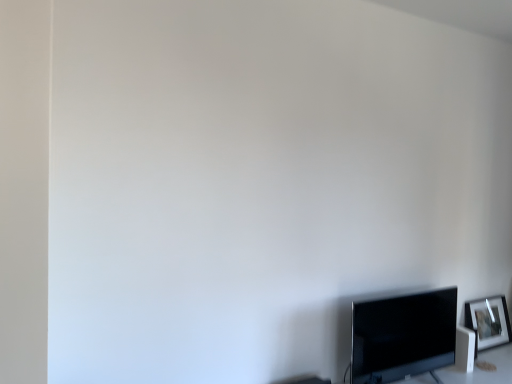
Measure the distance between silver metallic picture frame at lower right and camera.

They are 2.60 meters apart.

The image size is (512, 384). Describe the element at coordinates (488, 322) in the screenshot. I see `silver metallic picture frame at lower right` at that location.

The image size is (512, 384). I want to click on silver metallic picture frame at lower right, so click(488, 322).

This screenshot has height=384, width=512. Identify the location of matte black tv at lower right. (403, 336).

Measure the distance between point (423,334) and camera.

7.23 feet.

Consider the image. What is the approximate height of matte black tv at lower right?

matte black tv at lower right is 47.44 centimeters tall.

Describe the element at coordinates (403, 336) in the screenshot. I see `matte black tv at lower right` at that location.

The width and height of the screenshot is (512, 384). In order to click on silver metallic picture frame at lower right in this screenshot , I will do coord(488,322).

Is matte black tv at lower right at the left side of silver metallic picture frame at lower right?

Yes, matte black tv at lower right is to the left of silver metallic picture frame at lower right.

Is matte black tv at lower right positioned behind silver metallic picture frame at lower right?

No, the depth of matte black tv at lower right is less than that of silver metallic picture frame at lower right.

Is point (362, 378) closer to viewer compared to point (508, 321)?

Yes, point (362, 378) is closer to viewer.

From the image's perspective, does matte black tv at lower right appear higher than silver metallic picture frame at lower right?

Indeed, from the image's perspective, matte black tv at lower right is shown above silver metallic picture frame at lower right.

From a real-world perspective, which object stands above the other?

matte black tv at lower right.

Which of these two, matte black tv at lower right or silver metallic picture frame at lower right, is thinner?

silver metallic picture frame at lower right.

Is matte black tv at lower right taller than silver metallic picture frame at lower right?

Yes, matte black tv at lower right is taller than silver metallic picture frame at lower right.

Which of these two, matte black tv at lower right or silver metallic picture frame at lower right, is bigger?

matte black tv at lower right is bigger.

Consider the image. Is matte black tv at lower right outside of silver metallic picture frame at lower right?

Yes.

Does matte black tv at lower right touch silver metallic picture frame at lower right?

No, matte black tv at lower right is not with silver metallic picture frame at lower right.

Is silver metallic picture frame at lower right at the back of matte black tv at lower right?

That's not correct — matte black tv at lower right is not looking away from silver metallic picture frame at lower right.

Where is `picture frame below the matte black tv at lower right (from the image's perspective)`? picture frame below the matte black tv at lower right (from the image's perspective) is located at coordinates 488,322.

Is silver metallic picture frame at lower right to the left of matte black tv at lower right from the viewer's perspective?

No, silver metallic picture frame at lower right is not to the left of matte black tv at lower right.

Is silver metallic picture frame at lower right positioned in front of matte black tv at lower right?

No, it is behind matte black tv at lower right.

Between point (467, 309) and point (380, 312), which one is positioned in front?

The point (380, 312) is closer to the camera.

From the image's perspective, which one is positioned higher, silver metallic picture frame at lower right or matte black tv at lower right?

matte black tv at lower right, from the image's perspective.

From a real-world perspective, is silver metallic picture frame at lower right under matte black tv at lower right?

Correct, in the physical world, silver metallic picture frame at lower right is lower than matte black tv at lower right.

Considering the sizes of silver metallic picture frame at lower right and matte black tv at lower right in the image, is silver metallic picture frame at lower right wider or thinner than matte black tv at lower right?

Clearly, silver metallic picture frame at lower right has less width compared to matte black tv at lower right.

Who is shorter, silver metallic picture frame at lower right or matte black tv at lower right?

Standing shorter between the two is silver metallic picture frame at lower right.

Between silver metallic picture frame at lower right and matte black tv at lower right, which one has smaller size?

silver metallic picture frame at lower right.

Is matte black tv at lower right inside silver metallic picture frame at lower right?

That's incorrect, matte black tv at lower right is not inside silver metallic picture frame at lower right.

Based on the photo, is silver metallic picture frame at lower right placed right next to matte black tv at lower right?

They are not placed beside each other.

Is silver metallic picture frame at lower right looking in the opposite direction of matte black tv at lower right?

silver metallic picture frame at lower right is not turned away from matte black tv at lower right.

Can you tell me how much silver metallic picture frame at lower right and matte black tv at lower right differ in facing direction?

The angular difference between silver metallic picture frame at lower right and matte black tv at lower right is 0.000248 degrees.

I want to click on television on the left of silver metallic picture frame at lower right, so click(403, 336).

Locate an element on the screen. This screenshot has width=512, height=384. picture frame behind the matte black tv at lower right is located at coordinates (488, 322).

Find the location of `television on the left of silver metallic picture frame at lower right`. television on the left of silver metallic picture frame at lower right is located at coordinates (403, 336).